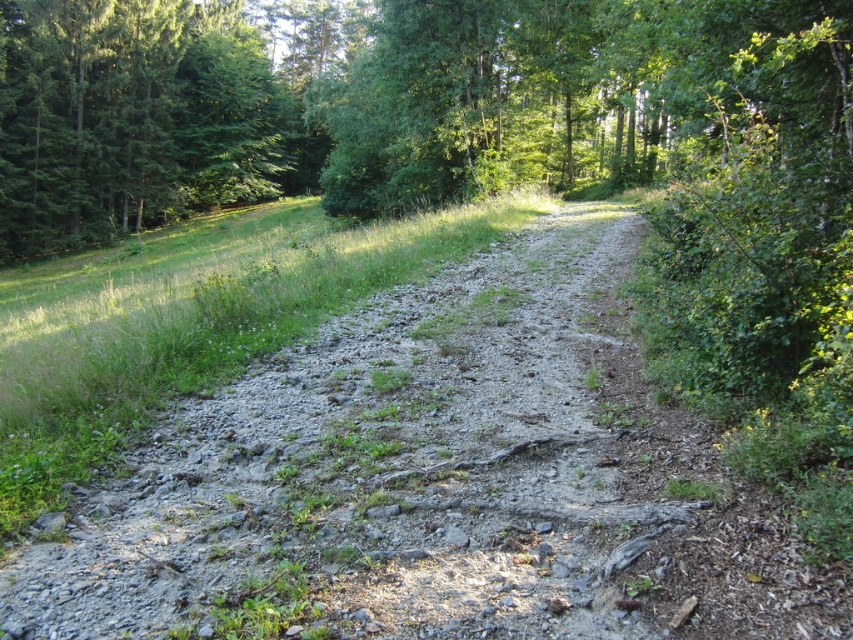
You are standing at the point marked by the coordinates point (x=434, y=483) on the gray gravel path at center. Looking around, you notice dense shrubs on your right and an open grassy field to your left. Which direction should you turn to avoid the dense shrubs and head towards the open area?

You should turn to your left to head towards the open grassy field and avoid the dense shrubs on your right.

You are a hiker trying to follow the gray gravel path at center. Based on the scene description, what challenges might you encounter while walking on it?

The gray gravel path at center is covered with small stones, pebbles, and patches of grass, making it uneven and potentially slippery underfoot.

You are a hiker walking along the gray gravel path at center and the green leafy tree at center. Which object is closer to the ground?

The gray gravel path at center is closer to the ground because it is below the green leafy tree at center.